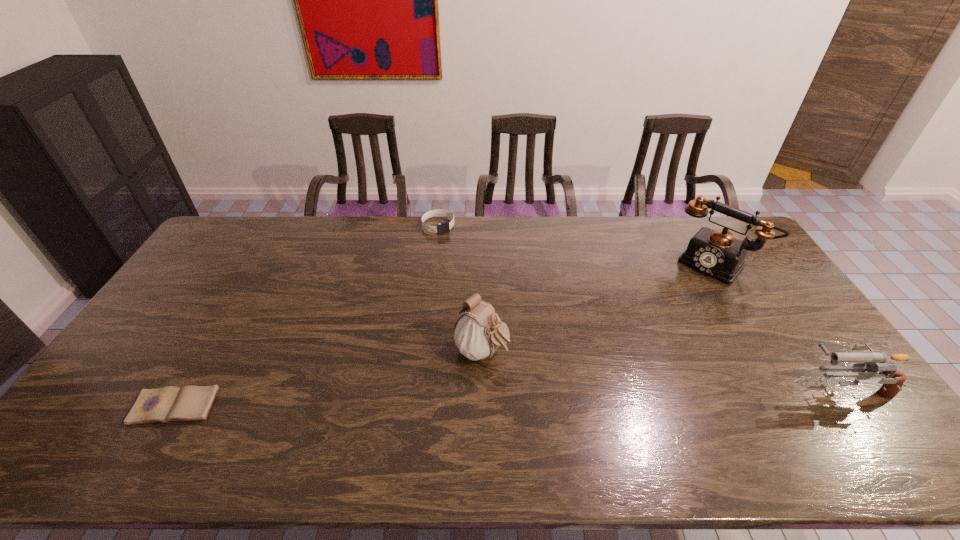
Where is `vacant spot on the desktop that is between the leftmost object and the third tallest object and is positioned on the front of the tallest object at the rotary dial`? vacant spot on the desktop that is between the leftmost object and the third tallest object and is positioned on the front of the tallest object at the rotary dial is located at coordinates (605, 394).

Where is `vacant spot on the desktop that is between the diary and the third shortest object and is positioned on the front-facing side of the third object from left to right`? The image size is (960, 540). vacant spot on the desktop that is between the diary and the third shortest object and is positioned on the front-facing side of the third object from left to right is located at coordinates [561, 396].

Where is `free space on the desktop that is between the shortest object and the gun and is positioned on the outer surface of the farthest object`? This screenshot has width=960, height=540. free space on the desktop that is between the shortest object and the gun and is positioned on the outer surface of the farthest object is located at coordinates (565, 395).